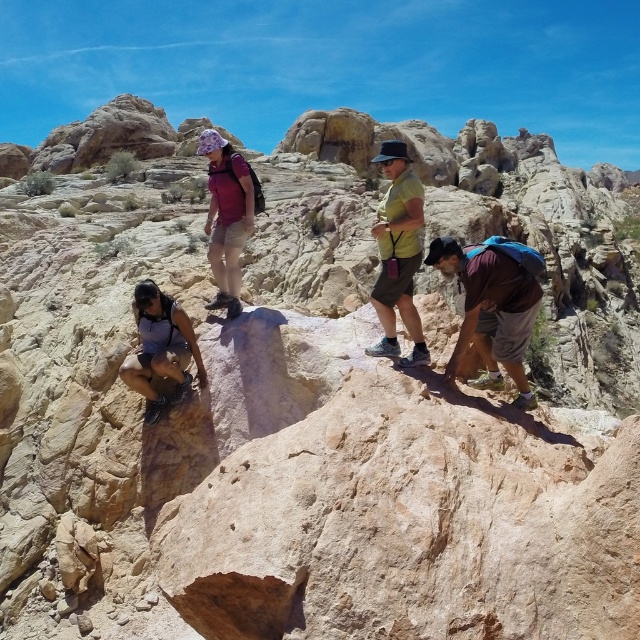
You are a hiker trying to locate your gear. You see the maroon fabric shirt at lower right and the green matte shorts at center. Which item is closer to the bottom of the image?

The maroon fabric shirt at lower right is positioned under the green matte shorts at center, so it is closer to the bottom of the image.

From the picture: You are a hiker trying to locate the maroon fabric shirt at lower right in the image. A GPS device marks a point at coordinates (493, 305). Is this point on the maroon fabric shirt at lower right?

Yes, the point at coordinates (493, 305) is on the maroon fabric shirt at lower right.

You are a photographer trying to capture a closeup of the green matte shorts at center and the purple fabric shirt at center in the hiking scene. Since you want to focus on both items equally, which object should you zoom in on more to ensure they appear the same size in the photo?

The green matte shorts at center occupies less space than purple fabric shirt at center, so you should zoom in more on the green matte shorts at center to make them appear the same size as the purple fabric shirt at center in the photo.